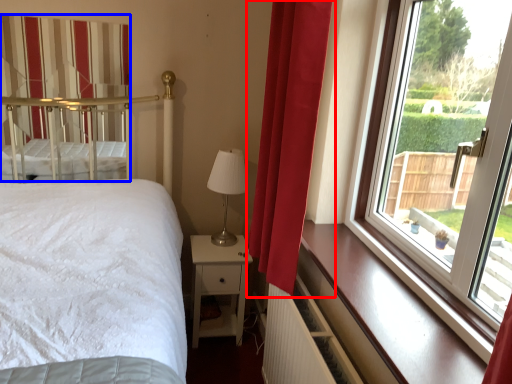
Question: Among these objects, which one is nearest to the camera, curtain (highlighted by a red box) or curtain (highlighted by a blue box)?

Choices:
 (A) curtain
 (B) curtain

Answer: (A)